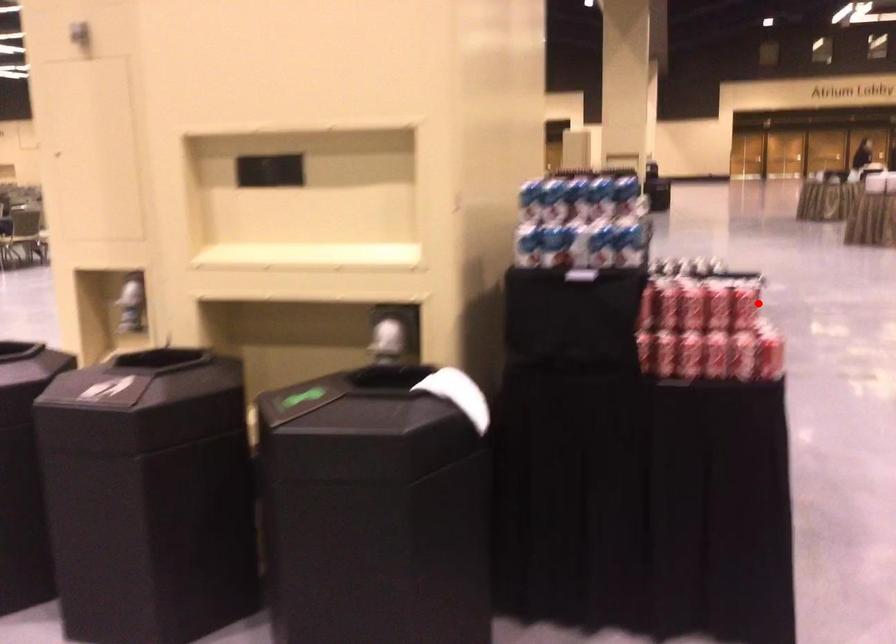
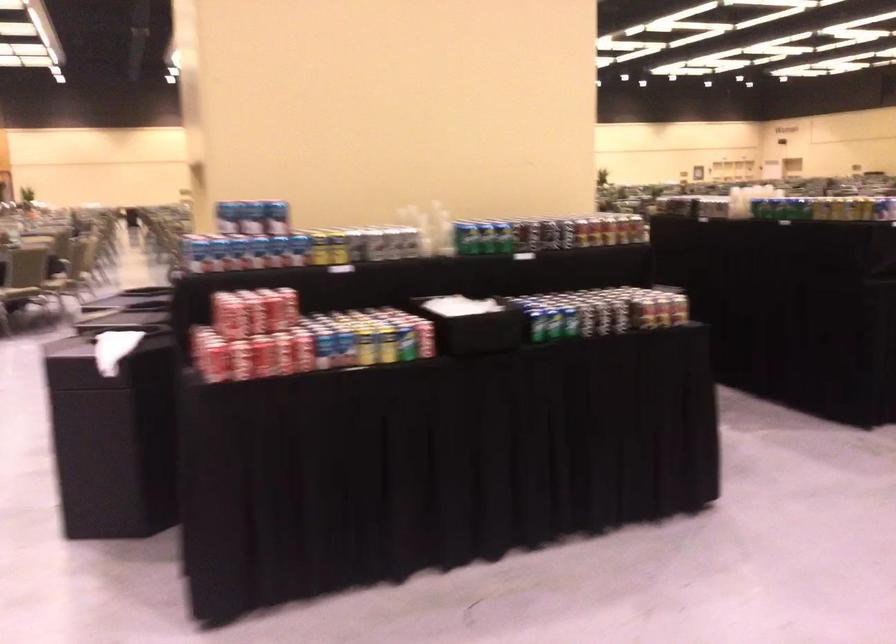
Question: I am providing you with two images of the same scene from different viewpoints. In image1, a red point is highlighted. Considering the same 3D point in image2, which of the following is correct?

Choices:
 (A) It is closer
 (B) It is farther

Answer: (B)